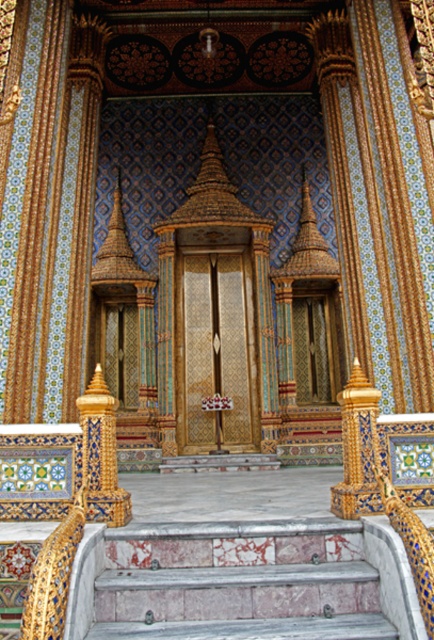
How much distance is there between marble steps at center and gold/gilded stone pillar at center?

The distance of marble steps at center from gold/gilded stone pillar at center is 2.75 meters.

Measure the distance between point (259, 608) and camera.

Point (259, 608) and camera are 32.60 feet apart from each other.

Is point (378, 589) less distant than point (375, 493)?

That is True.

Identify the location of marble steps at center. The height and width of the screenshot is (640, 434). (239, 582).